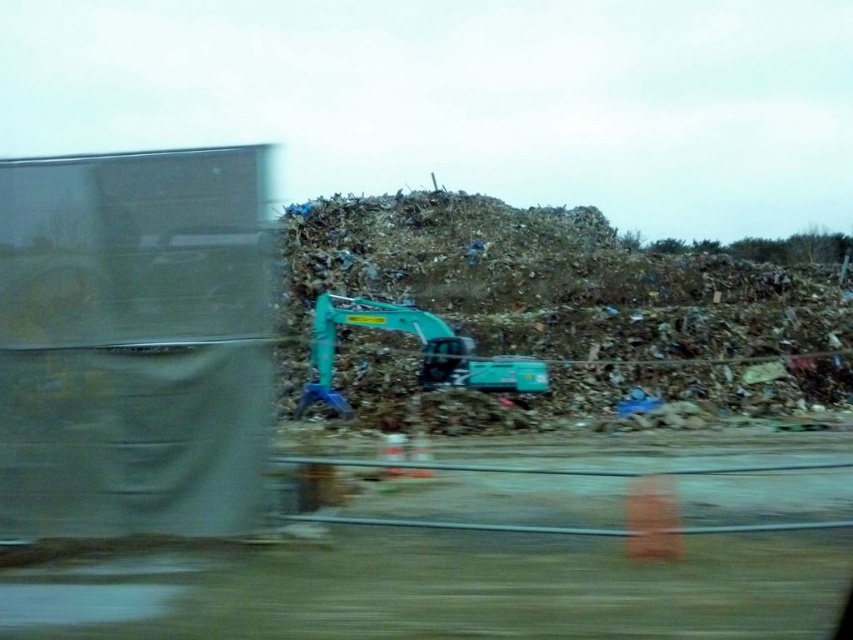
You are a waste management worker standing at the edge of the landfill. You need to move the teal plastic excavator at center to a new location. If the current position is at coordinates point 0.470, 0.674, what is the direction you should move it to reach the northernmost point of the landfill?

The northernmost point would be the highest point in the coordinate system. Since the current position is at point (573, 300), moving north would require increasing the y coordinate. Therefore, you should move the teal plastic excavator at center in the northern direction to reach the northernmost point.

You are a safety inspector at the landfill site. You need to ensure that the matte gray trailer truck at left and the teal plastic excavator at center are at least 15 meters apart for safety regulations. Based on the scene, are they compliant with the safety distance requirement?

The distance between the matte gray trailer truck at left and the teal plastic excavator at center is 16.42 meters, which exceeds the required 15 meters. Therefore, they are compliant with the safety regulations.